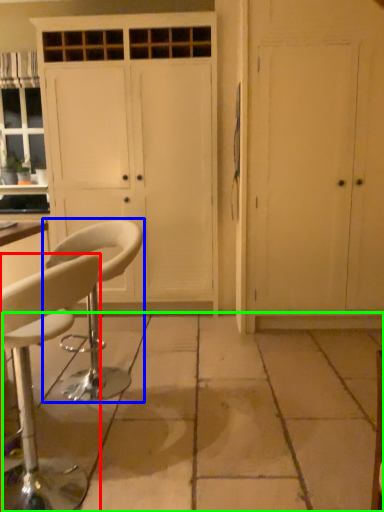
Question: Estimate the real-world distances between objects in this image. Which object is farther from chair (highlighted by a red box), chair (highlighted by a blue box) or concrete (highlighted by a green box)?

Choices:
 (A) chair
 (B) concrete

Answer: (B)